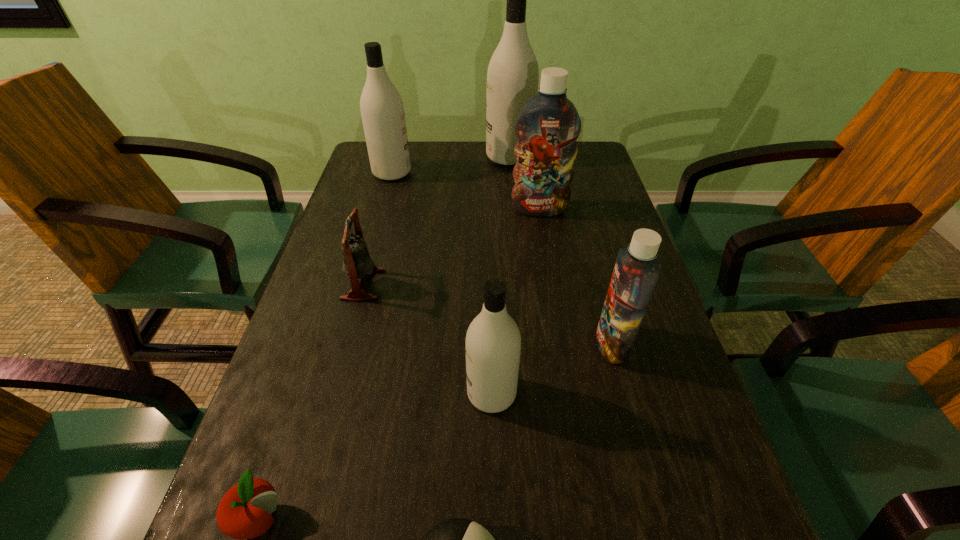
Identify the location of free space at the far right corner. The image size is (960, 540). (589, 165).

You are a GUI agent. You are given a task and a screenshot of the screen. Output one action in this format:
    pyautogui.click(x=<x>, y=<y>)
    Task: Click on the vacant space in between the third nearest object and the tallest object
    
    Given the screenshot: What is the action you would take?
    pyautogui.click(x=500, y=275)

I want to click on unoccupied area between the tallest object and the fifth farthest object, so click(x=561, y=250).

I want to click on free space between the third farthest object and the smaller blue shampoo, so click(576, 276).

This screenshot has height=540, width=960. I want to click on free spot between the smaller blue shampoo and the leftmost white shampoo, so click(502, 258).

Where is `vacant area that lies between the third farthest object and the fifth farthest object`? This screenshot has height=540, width=960. vacant area that lies between the third farthest object and the fifth farthest object is located at coordinates point(576,276).

Identify which object is the third nearest to the smaller blue shampoo. Please provide its 2D coordinates. Your answer should be formatted as a tuple, i.e. [(x, y)], where the tuple contains the x and y coordinates of a point satisfying the conditions above.

[(548, 126)]

Find the location of a particular element. The width and height of the screenshot is (960, 540). object that is the second closest to the red apple is located at coordinates (493, 342).

Locate an element on the screen. The height and width of the screenshot is (540, 960). shampoo that is the closest to the leftmost shampoo is located at coordinates (513, 74).

The image size is (960, 540). In order to click on shampoo identified as the fourth closest to the apple in this screenshot , I will do `click(382, 110)`.